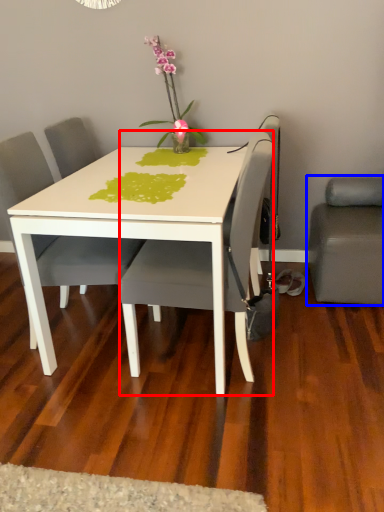
Question: Among these objects, which one is farthest to the camera, chair (highlighted by a red box) or studio couch (highlighted by a blue box)?

Choices:
 (A) chair
 (B) studio couch

Answer: (B)